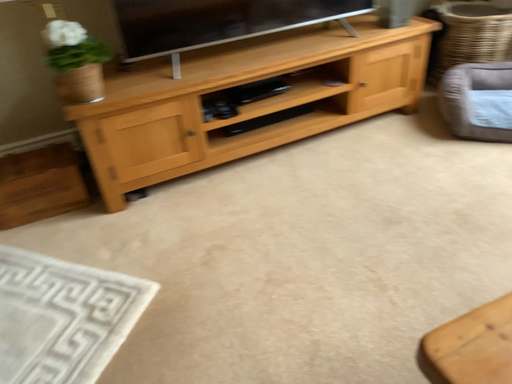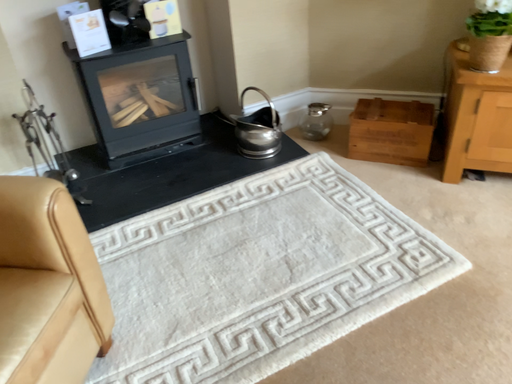
Question: Which way did the camera rotate in the video?

Choices:
 (A) rotated right
 (B) rotated left

Answer: (B)